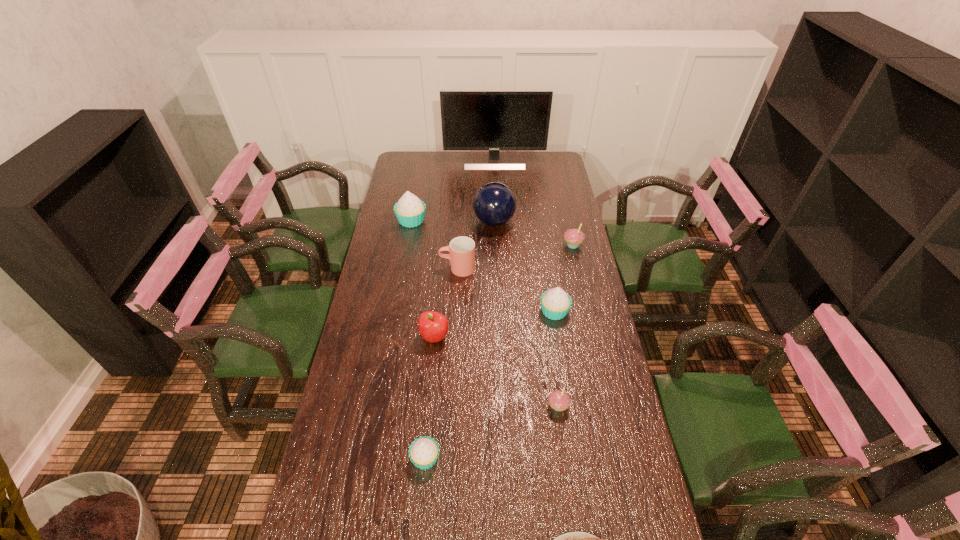
You are a GUI agent. You are given a task and a screenshot of the screen. Output one action in this format:
    pyautogui.click(x=<x>, y=<y>)
    Task: Click on the free area in between the right pink cupcake and the third farthest cupcake
    This screenshot has height=540, width=960.
    Given the screenshot: What is the action you would take?
    pyautogui.click(x=564, y=278)

Locate an element on the screen. The width and height of the screenshot is (960, 540). unoccupied position between the seventh farthest object and the sixth nearest object is located at coordinates (446, 302).

Identify the location of free space between the smallest white cupcake and the red apple. (430, 397).

Find the location of a particular element. This screenshot has height=540, width=960. free spot between the fifth nearest object and the eighth farthest object is located at coordinates (556, 359).

You are a GUI agent. You are given a task and a screenshot of the screen. Output one action in this format:
    pyautogui.click(x=<x>, y=<y>)
    Task: Click on the vacant space that is in between the apple and the fourth farthest cupcake
    
    Given the screenshot: What is the action you would take?
    pyautogui.click(x=496, y=372)

Locate an element on the screen. empty location between the smaller pink cupcake and the eighth shortest object is located at coordinates (485, 313).

Identify which object is located as the third nearest to the second cupcake from left to right. Please provide its 2D coordinates. Your answer should be formatted as a tuple, i.e. [(x, y)], where the tuple contains the x and y coordinates of a point satisfying the conditions above.

[(433, 326)]

Select which object appears as the closest to the fourth nearest object. Please provide its 2D coordinates. Your answer should be formatted as a tuple, i.e. [(x, y)], where the tuple contains the x and y coordinates of a point satisfying the conditions above.

[(462, 249)]

Identify the location of cupcake that is the third nearest to the third nearest object. (574, 237).

Select which cupcake appears as the third closest to the second nearest cupcake. Please provide its 2D coordinates. Your answer should be formatted as a tuple, i.e. [(x, y)], where the tuple contains the x and y coordinates of a point satisfying the conditions above.

[(574, 237)]